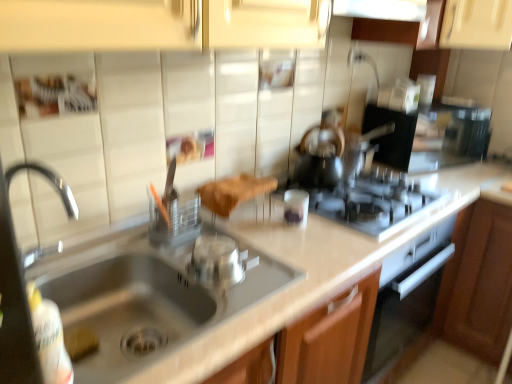
In order to click on stainless steel sink at lower left in this screenshot , I will do `click(146, 301)`.

What do you see at coordinates (372, 202) in the screenshot? I see `satin silver gas stove at center` at bounding box center [372, 202].

Where is `transparent glass candle at center, which ranks as the second appliance in front-to-back order`? The height and width of the screenshot is (384, 512). transparent glass candle at center, which ranks as the second appliance in front-to-back order is located at coordinates (296, 206).

Where is `black plastic coffee machine at upper right`? black plastic coffee machine at upper right is located at coordinates (429, 136).

Which object is closer to the camera taking this photo, beige laminate counter top at center or stainless steel sink at lower left?

beige laminate counter top at center.

Who is shorter, beige laminate counter top at center or stainless steel sink at lower left?

Standing shorter between the two is stainless steel sink at lower left.

Considering the points (245, 228) and (203, 295), which point is behind, point (245, 228) or point (203, 295)?

Point (245, 228)

From a real-world perspective, is beige laminate counter top at center located higher than transparent glass candle at center, which is counted as the 2th appliance, starting from the left?

Incorrect, from a real-world perspective, beige laminate counter top at center is lower than transparent glass candle at center, which is counted as the 2th appliance, starting from the left.

Looking at the image, does beige laminate counter top at center seem bigger or smaller compared to transparent glass candle at center, which is counted as the first appliance, starting from the right?

In the image, beige laminate counter top at center appears to be larger than transparent glass candle at center, which is counted as the first appliance, starting from the right.

Looking at this image, is beige laminate counter top at center looking in the opposite direction of transparent glass candle at center, which ranks as the 2th appliance in bottom-to-top order?

beige laminate counter top at center does not have its back to transparent glass candle at center, which ranks as the 2th appliance in bottom-to-top order.

Does beige laminate counter top at center contain transparent glass candle at center, which is counted as the 2th appliance, starting from the left?

No.

How much distance is there between brown wood cabinet at lower right and translucent glass tea pot at center?

They are 32.14 inches apart.

Is brown wood cabinet at lower right aimed at translucent glass tea pot at center?

No, brown wood cabinet at lower right is not turned towards translucent glass tea pot at center.

Visually, is brown wood cabinet at lower right positioned to the left or to the right of translucent glass tea pot at center?

brown wood cabinet at lower right is positioned on translucent glass tea pot at center's right side.

Are brown wood cabinet at lower right and translucent glass tea pot at center located far from each other?

No, brown wood cabinet at lower right is not far away from translucent glass tea pot at center.

Looking at their sizes, would you say silver metallic pot at center, which is the 2th appliance from back to front, is wider or thinner than brown fabric at center?

In the image, silver metallic pot at center, which is the 2th appliance from back to front, appears to be more narrow than brown fabric at center.

Consider the image. Considering the relative sizes of silver metallic pot at center, arranged as the first appliance when viewed from the left, and brown fabric at center in the image provided, is silver metallic pot at center, arranged as the first appliance when viewed from the left, shorter than brown fabric at center?

Correct, silver metallic pot at center, arranged as the first appliance when viewed from the left, is not as tall as brown fabric at center.

Locate an element on the screen. This screenshot has width=512, height=384. appliance on the left of brown fabric at center is located at coordinates (217, 261).

From the image's perspective, which one is positioned higher, silver metallic pot at center, which is the 2th appliance from back to front, or brown fabric at center?

brown fabric at center appears higher in the image.

From their relative heights in the image, would you say transparent glass candle at center, which is counted as the 2th appliance, starting from the left, is taller or shorter than satin silver gas stove at center?

Clearly, transparent glass candle at center, which is counted as the 2th appliance, starting from the left, is taller compared to satin silver gas stove at center.

In the scene shown: Is transparent glass candle at center, which is counted as the first appliance, starting from the right, closer to camera compared to satin silver gas stove at center?

No, transparent glass candle at center, which is counted as the first appliance, starting from the right, is further to the viewer.

Is transparent glass candle at center, which is counted as the 2th appliance, starting from the left, aimed at satin silver gas stove at center?

No, transparent glass candle at center, which is counted as the 2th appliance, starting from the left, does not turn towards satin silver gas stove at center.

Is transparent glass candle at center, which ranks as the second appliance in front-to-back order, inside or outside of satin silver gas stove at center?

transparent glass candle at center, which ranks as the second appliance in front-to-back order, is not inside satin silver gas stove at center, it's outside.

Who is bigger, stainless steel sink at lower left or black plastic coffee machine at upper right?

stainless steel sink at lower left.

I want to click on coffee machine above the stainless steel sink at lower left (from a real-world perspective), so click(x=429, y=136).

Which object is positioned more to the left, stainless steel sink at lower left or black plastic coffee machine at upper right?

stainless steel sink at lower left is more to the left.

Which object is further away from the camera, stainless steel sink at lower left or black plastic coffee machine at upper right?

Positioned behind is black plastic coffee machine at upper right.

Between translucent glass tea pot at center and brown wood cabinet at lower right, which one appears on the left side from the viewer's perspective?

Positioned to the left is translucent glass tea pot at center.

Based on the photo, which object is wider, translucent glass tea pot at center or brown wood cabinet at lower right?

brown wood cabinet at lower right is wider.

How much distance is there between translucent glass tea pot at center and brown wood cabinet at lower right?

translucent glass tea pot at center and brown wood cabinet at lower right are 32.14 inches apart from each other.

What's the angular difference between translucent glass tea pot at center and brown wood cabinet at lower right's facing directions?

The angular difference between translucent glass tea pot at center and brown wood cabinet at lower right is 90.2 degrees.

The width and height of the screenshot is (512, 384). In order to click on sink above the beige laminate counter top at center (from a real-world perspective) in this screenshot , I will do `click(146, 301)`.

Starting from the beige laminate counter top at center, which appliance is the 2nd one behind? Please provide its 2D coordinates.

[(296, 206)]

Looking at the image, which one is located closer to beige laminate counter top at center, silver metallic pot at center, the 1th appliance from the bottom, or satin silver gas stove at center?

satin silver gas stove at center is closer to beige laminate counter top at center.

When comparing their distances from satin silver gas stove at center, does transparent glass candle at center, which is counted as the first appliance, starting from the right, or stainless steel sink at lower left seem closer?

The object closer to satin silver gas stove at center is transparent glass candle at center, which is counted as the first appliance, starting from the right.

Considering their positions, is silver metallic pot at center, placed as the 1th appliance when sorted from front to back, positioned closer to brown wood cabinet at lower right than satin silver gas stove at center?

The object closer to brown wood cabinet at lower right is satin silver gas stove at center.

Estimate the real-world distances between objects in this image. Which object is closer to stainless steel sink at lower left, brown wood cabinet at lower right or black plastic coffee machine at upper right?

brown wood cabinet at lower right is closer to stainless steel sink at lower left.

Which object lies nearer to the anchor point transparent glass candle at center, which is counted as the 2th appliance, starting from the left, translucent glass tea pot at center or brown fabric at center?

Among the two, brown fabric at center is located nearer to transparent glass candle at center, which is counted as the 2th appliance, starting from the left.

Considering their positions, is stainless steel sink at lower left positioned closer to silver metallic pot at center, which is the 2th appliance from back to front, than transparent glass candle at center, which is counted as the 1th appliance, starting from the top?

stainless steel sink at lower left lies closer to silver metallic pot at center, which is the 2th appliance from back to front, than the other object.

When comparing their distances from satin silver gas stove at center, does transparent glass candle at center, acting as the 1th appliance starting from the back, or brown fabric at center seem closer?

transparent glass candle at center, acting as the 1th appliance starting from the back, is positioned closer to the anchor satin silver gas stove at center.

Estimate the real-world distances between objects in this image. Which object is further from silver metallic pot at center, arranged as the first appliance when viewed from the left, black plastic coffee machine at upper right or brown wood cabinet at lower right?

black plastic coffee machine at upper right is further to silver metallic pot at center, arranged as the first appliance when viewed from the left.

Identify the location of counter top between translucent glass tea pot at center and brown wood cabinet at lower right. (311, 273).

In order to click on counter top located between transparent glass candle at center, acting as the 1th appliance starting from the back, and brown wood cabinet at lower right in the left-right direction in this screenshot , I will do `click(311, 273)`.

Where is `coffee machine between stainless steel sink at lower left and brown wood cabinet at lower right`? The image size is (512, 384). coffee machine between stainless steel sink at lower left and brown wood cabinet at lower right is located at coordinates (429, 136).

Find the location of a particular element. The width and height of the screenshot is (512, 384). food positioned between beige laminate counter top at center and translucent glass tea pot at center from near to far is located at coordinates (234, 192).